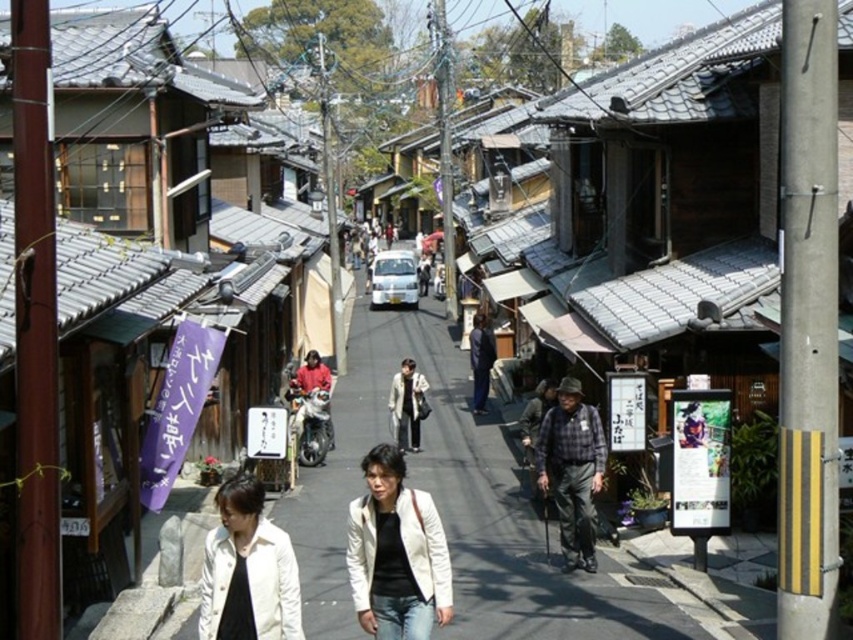
Is white leather jacket at center above dark blue jeans at center?

No, white leather jacket at center is not above dark blue jeans at center.

This screenshot has height=640, width=853. Describe the element at coordinates (396, 554) in the screenshot. I see `white leather jacket at center` at that location.

Who is more distant from viewer, (416,588) or (489,339)?

Point (489,339)

Locate an element on the screen. The height and width of the screenshot is (640, 853). white leather jacket at center is located at coordinates (396, 554).

How distant is plaid fabric hat at center from shiny silver motorcycle at center?

plaid fabric hat at center is 7.26 meters from shiny silver motorcycle at center.

Does plaid fabric hat at center appear on the left side of shiny silver motorcycle at center?

In fact, plaid fabric hat at center is to the right of shiny silver motorcycle at center.

Between point (589, 481) and point (299, 422), which one is positioned behind?

Point (299, 422)

What are the coordinates of `plaid fabric hat at center` in the screenshot? It's located at (572, 468).

Is shiny silver motorcycle at center to the right of light beige jacket at center from the viewer's perspective?

Incorrect, shiny silver motorcycle at center is not on the right side of light beige jacket at center.

Does shiny silver motorcycle at center have a lesser height compared to light beige jacket at center?

Indeed, shiny silver motorcycle at center has a lesser height compared to light beige jacket at center.

Who is more forward, (300, 460) or (409, 356)?

Point (300, 460) is in front.

Find the location of a particular element. Image resolution: width=853 pixels, height=640 pixels. shiny silver motorcycle at center is located at coordinates (310, 424).